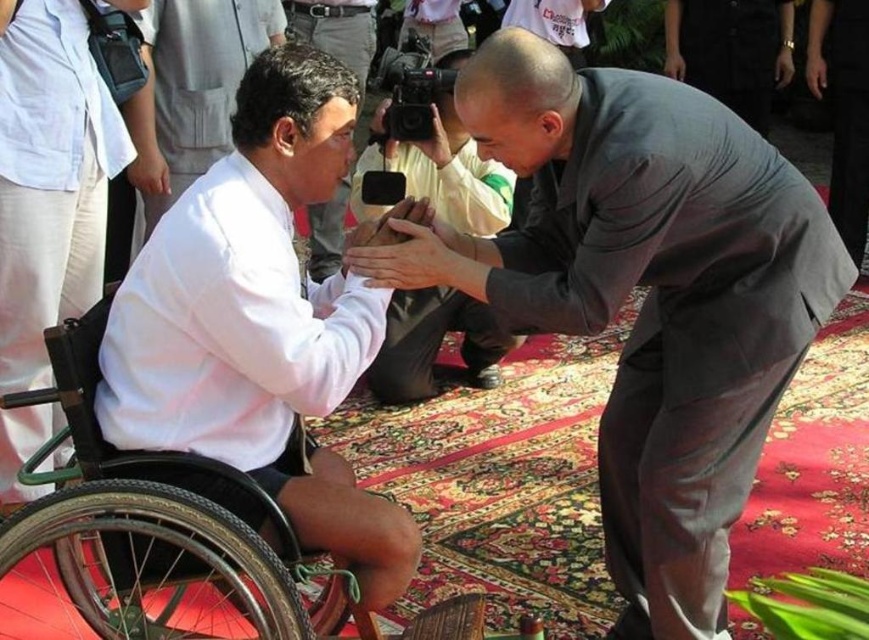
Is gray suit at center shorter than white matte shirt at left?

In fact, gray suit at center may be taller than white matte shirt at left.

Does gray suit at center appear on the right side of white matte shirt at left?

Correct, you'll find gray suit at center to the right of white matte shirt at left.

Measure the distance between point (708, 490) and camera.

Point (708, 490) and camera are 9.18 feet apart.

Locate an element on the screen. gray suit at center is located at coordinates (645, 296).

Between white matte shirt at left and smooth beige handbag at center, which one is positioned lower?

Positioned lower is white matte shirt at left.

Which is above, white matte shirt at left or smooth beige handbag at center?

smooth beige handbag at center

At what (x,y) coordinates should I click in order to perform the action: click on white matte shirt at left. Please return your answer as a coordinate pair (x, y). The width and height of the screenshot is (869, 640). Looking at the image, I should click on (259, 323).

Can you confirm if white matte shirt at left is positioned to the left of black rubber wheelchair at left?

No, white matte shirt at left is not to the left of black rubber wheelchair at left.

This screenshot has height=640, width=869. Identify the location of white matte shirt at left. (259, 323).